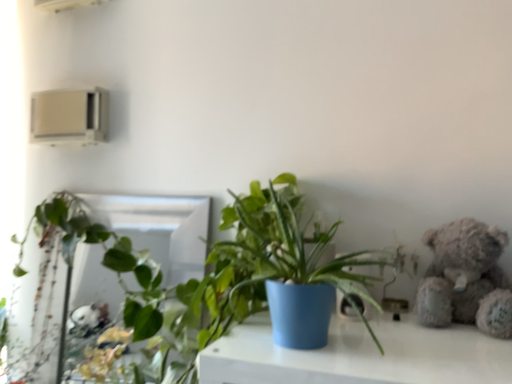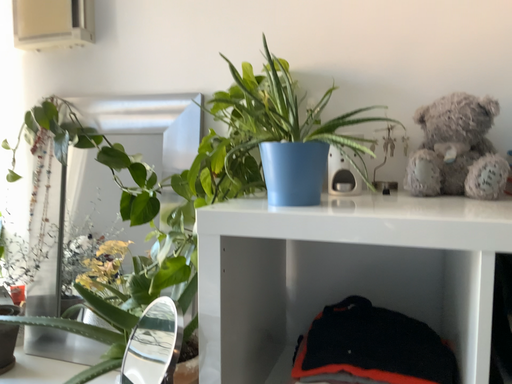
Question: Which way did the camera rotate in the video?

Choices:
 (A) rotated upward
 (B) rotated downward

Answer: (B)